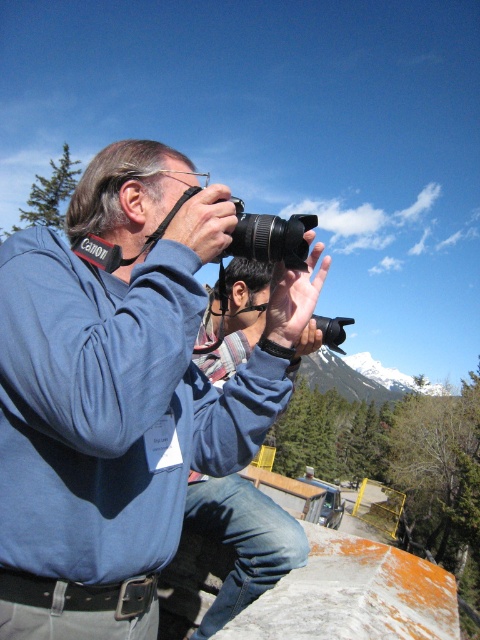
Question: Which object is closer to the camera taking this photo?

Choices:
 (A) matte blue sweatshirt at center
 (B) blue fabric shirt at center

Answer: (A)

Question: Where is matte blue sweatshirt at center located in relation to blue fabric shirt at center in the image?

Choices:
 (A) left
 (B) right

Answer: (A)

Question: Does matte blue sweatshirt at center lie behind blue fabric shirt at center?

Choices:
 (A) no
 (B) yes

Answer: (A)

Question: Which point appears farthest from the camera in this image?

Choices:
 (A) (266, 506)
 (B) (189, 333)

Answer: (A)

Question: Which point is farther from the camera taking this photo?

Choices:
 (A) [x=96, y=540]
 (B) [x=307, y=340]
 (C) [x=315, y=220]

Answer: (B)

Question: Can you confirm if matte blue sweatshirt at center is smaller than black plastic camera at center?

Choices:
 (A) no
 (B) yes

Answer: (B)